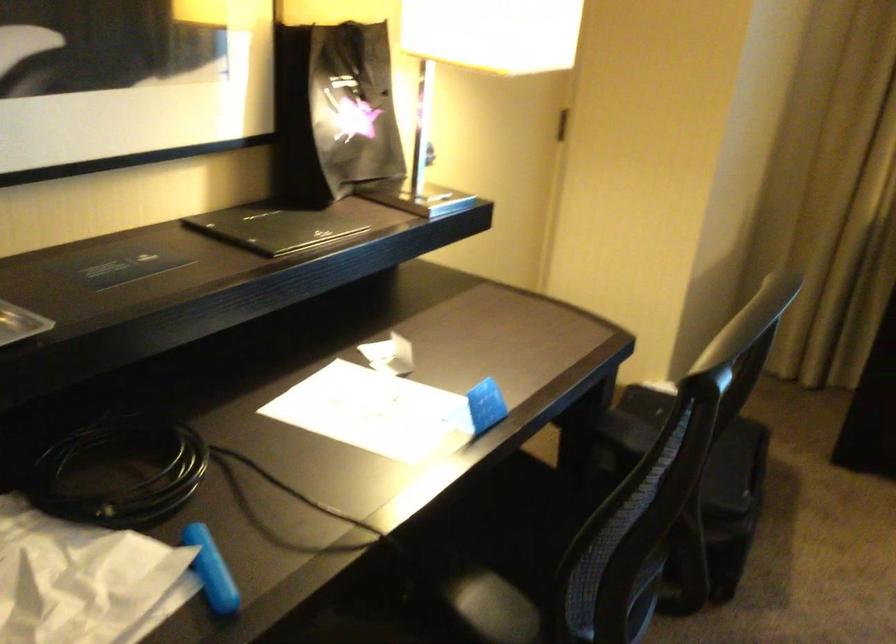
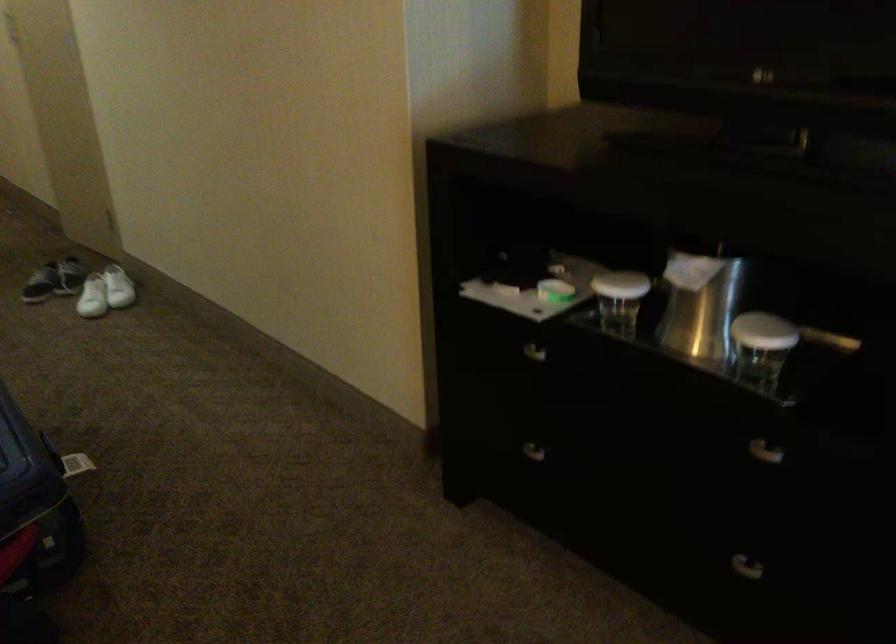
Based on the continuous images, in which direction is the camera rotating?

The camera's rotation is toward left-down.